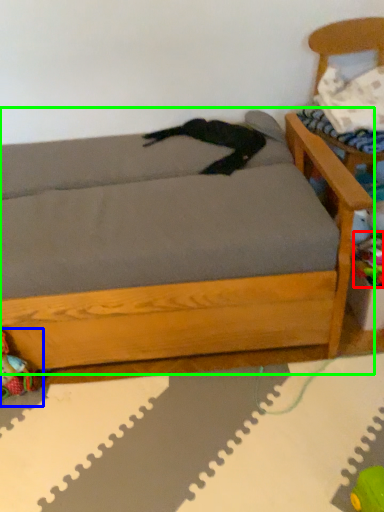
Question: Which object is positioned closest to toy (highlighted by a red box)? Select from toy (highlighted by a blue box) and studio couch (highlighted by a green box).

Choices:
 (A) toy
 (B) studio couch

Answer: (B)